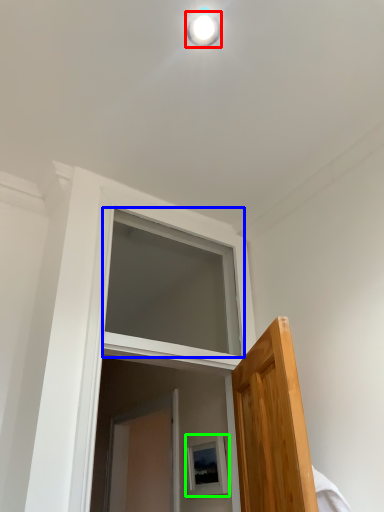
Question: Which object is the farthest from light fixture (highlighted by a red box)? Choose among these: window (highlighted by a blue box) or picture frame (highlighted by a green box).

Choices:
 (A) window
 (B) picture frame

Answer: (B)